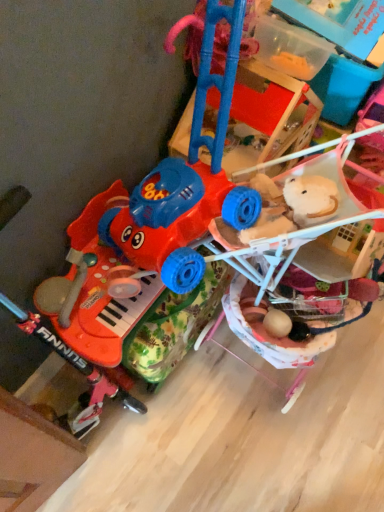
In order to face white fabric baby carriage at center-right, should I rotate leftwards or rightwards?

A 13.475 degree turn to the right will do.

Where is `white fabric baby carriage at center-right`? The height and width of the screenshot is (512, 384). white fabric baby carriage at center-right is located at coordinates tap(301, 271).

Describe the element at coordinates (301, 271) in the screenshot. The height and width of the screenshot is (512, 384). I see `white fabric baby carriage at center-right` at that location.

Where is `white fabric baby carriage at center-right`? white fabric baby carriage at center-right is located at coordinates (301, 271).